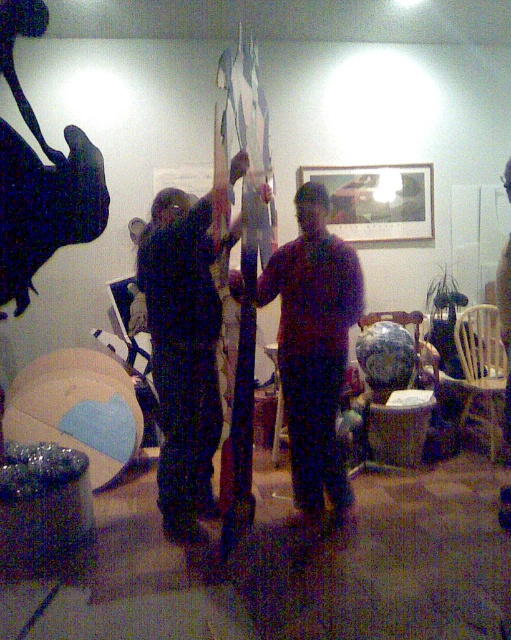
You are a photographer adjusting your camera settings in a dimly lit room. You notice two items at the center of the scene, the black fabric pants at center and the matte dark brown shirt at center. Which item should you focus on first to ensure proper depth of field?

The black fabric pants at center is closer to the viewer than the matte dark brown shirt at center, so focusing on the black fabric pants at center first will help establish the correct depth of field for both objects.

You are standing in the dimly lit room and need to locate the black fabric pants at center. Based on the coordinates provided, where exactly would you find them in the image?

The black fabric pants at center are located at point coordinates of 0.547 on the x axis and 0.362 on the y axis.